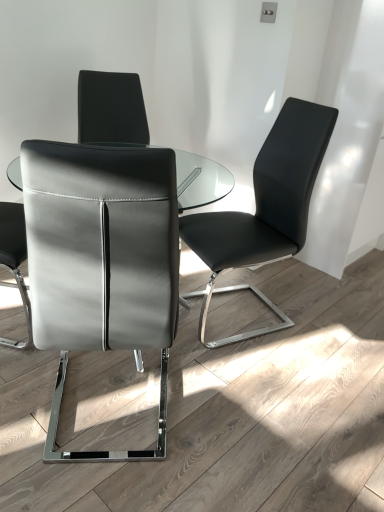
Identify the location of vacant area to the right of matte black chair at left, positioned as the 2th chair in right-to-left order. (232, 410).